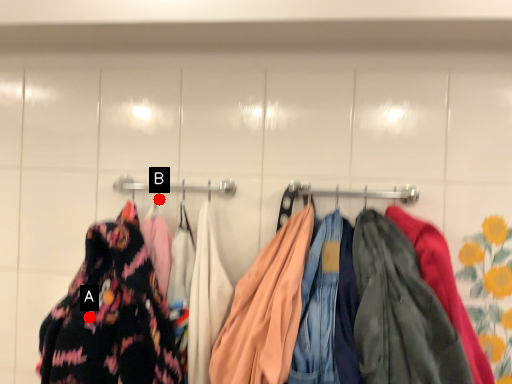
Question: Two points are circled on the image, labeled by A and B beside each circle. Which point is farther to the camera?

Choices:
 (A) A is further
 (B) B is further

Answer: (B)